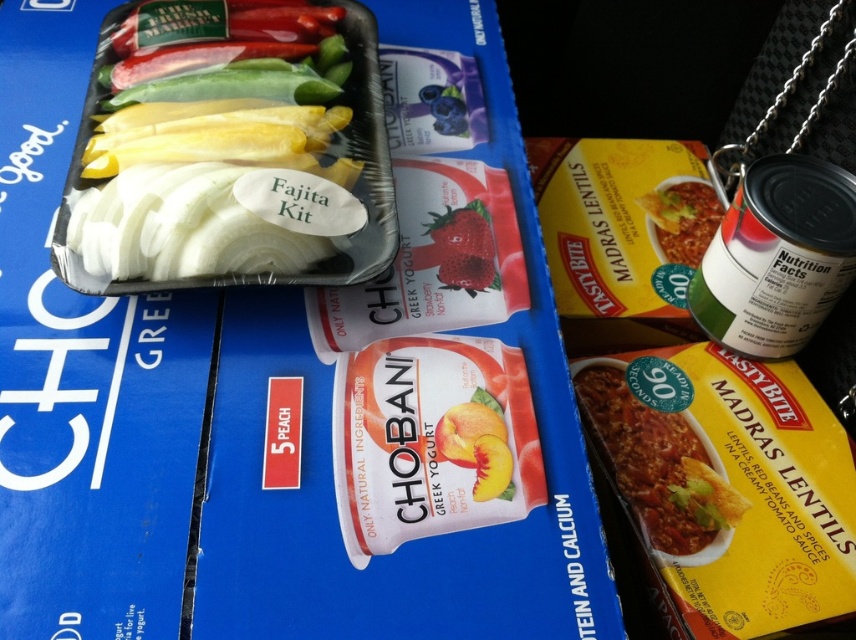
You are organizing a pantry and need to stack the yellow matte lentils at lower right and the strawberry matte at center. Which one should you place on the bottom to ensure stability?

The yellow matte lentins at lower right is taller than the strawberry matte at center, so you should place the yellow matte lentils at lower right on the bottom to ensure stability because taller items are better at the base for stability.

You are organizing groceries in a small refrigerator shelf. The clear plastic fajita kit at upper left and the green matte can at upper right need to be placed on the same shelf. Based on their positions in the image, which item should you place first to ensure both fit properly?

The clear plastic fajita kit at upper left should be placed first because it is positioned over the green matte can at upper right in the image, indicating it takes up more space above the can and needs to be placed first to accommodate both items.